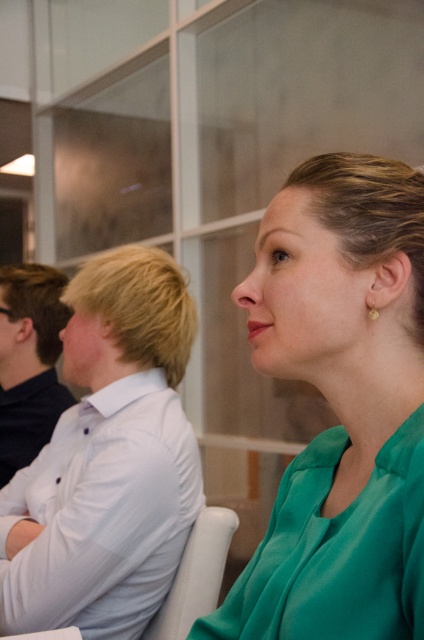
Question: Among these objects, which one is farthest from the camera?

Choices:
 (A) green satin blouse at center
 (B) white shirt at left

Answer: (B)

Question: Does green satin blouse at center have a lesser width compared to white shirt at left?

Choices:
 (A) no
 (B) yes

Answer: (B)

Question: Does green satin blouse at center have a greater width compared to white shirt at left?

Choices:
 (A) yes
 (B) no

Answer: (B)

Question: Which of the following is the closest to the observer?

Choices:
 (A) green satin blouse at center
 (B) white shirt at left

Answer: (A)

Question: Can you confirm if green satin blouse at center is positioned to the left of white shirt at left?

Choices:
 (A) yes
 (B) no

Answer: (B)